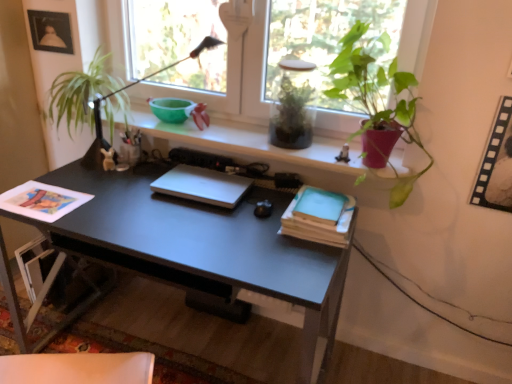
Find the location of `free space in front of light blue paper at center right, the 1th paperback book ordered from the bottom`. free space in front of light blue paper at center right, the 1th paperback book ordered from the bottom is located at coordinates (296, 261).